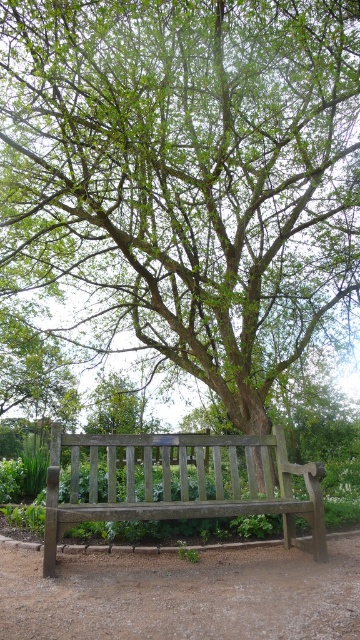
Can you confirm if dirt path at lower center is positioned above wooden bench at center?

No, dirt path at lower center is not above wooden bench at center.

Is dirt path at lower center in front of wooden bench at center?

Yes.

Is point (324, 570) positioned behind point (320, 497)?

No, it is in front of (320, 497).

Identify the location of dirt path at lower center. (182, 595).